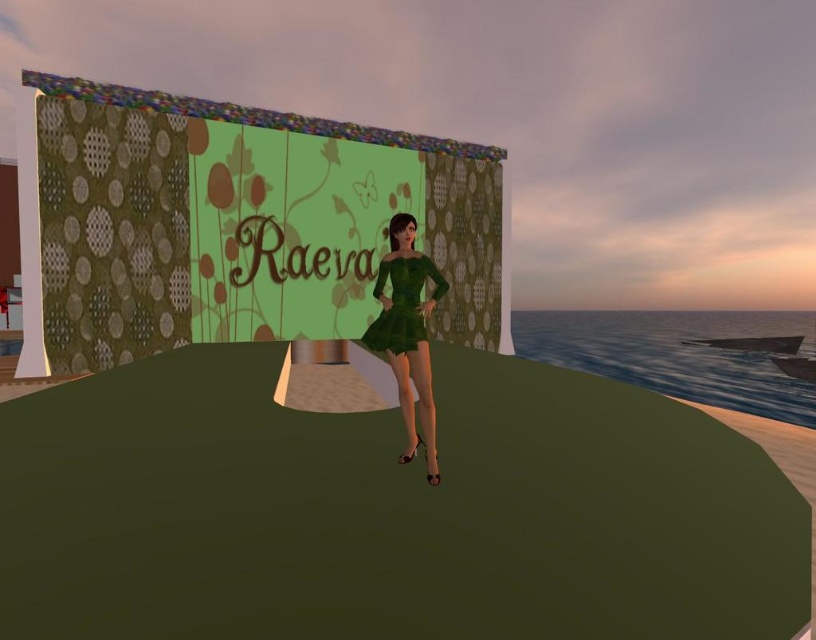
Question: Can you confirm if green satin dress at center is positioned below green velvet dress at center?

Choices:
 (A) yes
 (B) no

Answer: (A)

Question: Is the position of green satin dress at center more distant than that of green velvet dress at center?

Choices:
 (A) no
 (B) yes

Answer: (A)

Question: Does green satin dress at center have a greater width compared to green velvet dress at center?

Choices:
 (A) no
 (B) yes

Answer: (B)

Question: Which point is closer to the camera?

Choices:
 (A) (389, 244)
 (B) (382, 342)

Answer: (B)

Question: Among these objects, which one is farthest from the camera?

Choices:
 (A) green satin dress at center
 (B) green velvet dress at center

Answer: (B)